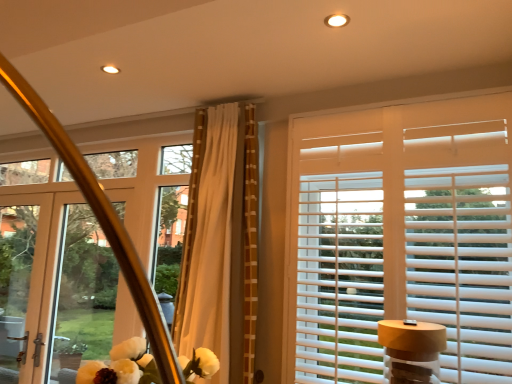
Question: Does point (241, 276) appear closer or farther from the camera than point (312, 268)?

Choices:
 (A) farther
 (B) closer

Answer: (B)

Question: Is beige textured curtain at center wider or thinner than white wood blinds at upper right?

Choices:
 (A) thin
 (B) wide

Answer: (B)

Question: Which is farther from the beige textured curtain at center?

Choices:
 (A) clear glass screen door at left
 (B) matte white door at left
 (C) white wood blinds at upper right

Answer: (A)

Question: Which of these objects is positioned farthest from the white wood blinds at upper right?

Choices:
 (A) beige textured curtain at center
 (B) clear glass screen door at left
 (C) matte white door at left

Answer: (B)